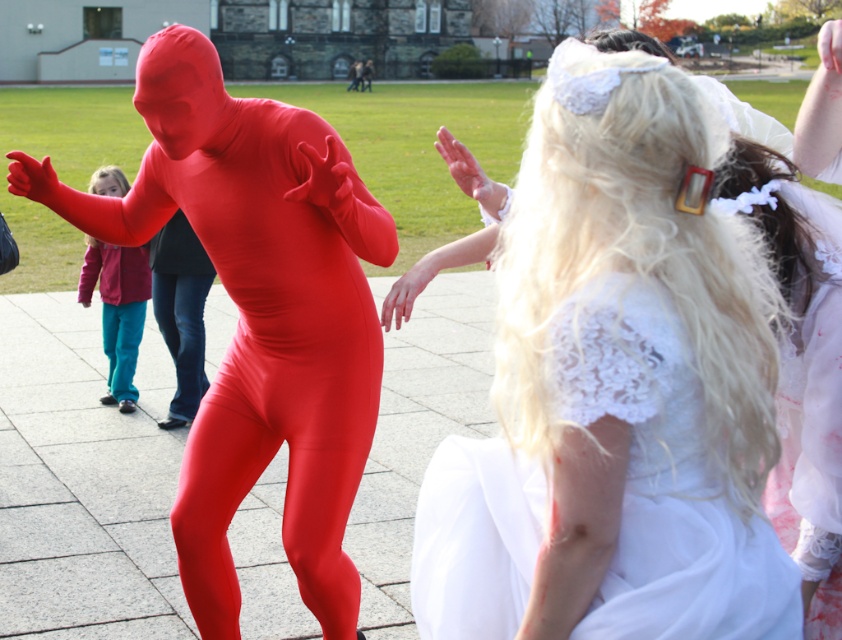
Question: Does matte pink jacket at left appear under denim at left?

Choices:
 (A) no
 (B) yes

Answer: (A)

Question: Among these points, which one is nearest to the camera?

Choices:
 (A) (184, 292)
 (B) (542, 513)
 (C) (296, 177)
 (D) (108, 177)

Answer: (B)

Question: Which point is farther to the camera?

Choices:
 (A) [x=132, y=368]
 (B) [x=198, y=358]
 (C) [x=630, y=557]
 (D) [x=308, y=596]

Answer: (A)

Question: Does white lace dress at upper right come behind denim at left?

Choices:
 (A) no
 (B) yes

Answer: (A)

Question: Which of the following is the closest to the observer?

Choices:
 (A) matte red suit at left
 (B) matte pink jacket at left

Answer: (A)

Question: Is white lace dress at upper right above denim at left?

Choices:
 (A) yes
 (B) no

Answer: (B)